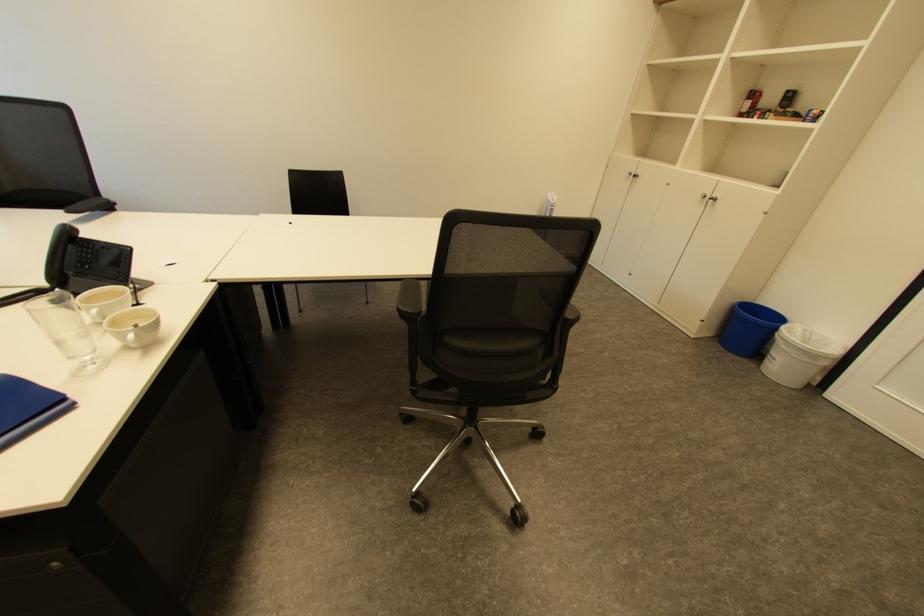
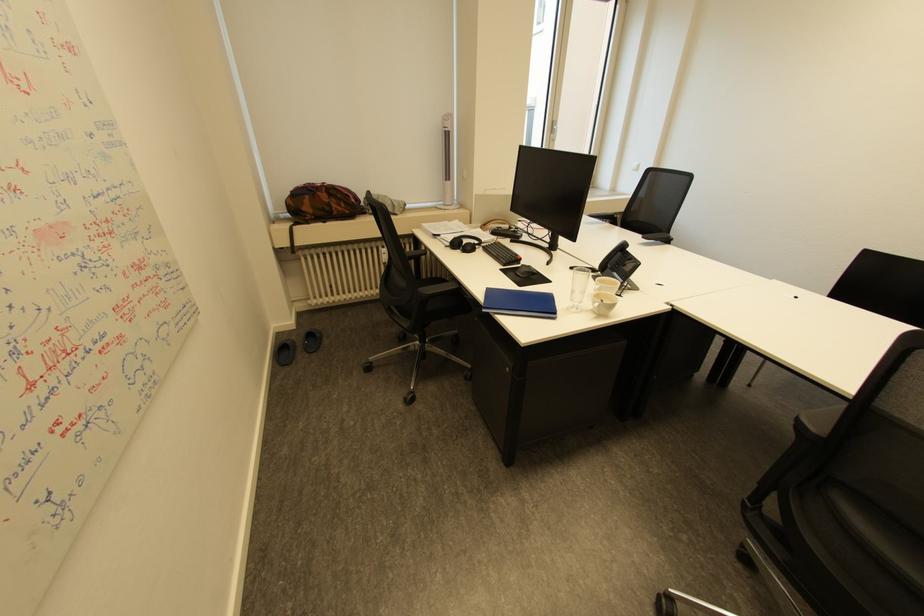
Locate, in the second image, the point that corresponds to point 131,347 in the first image.

(600, 310)